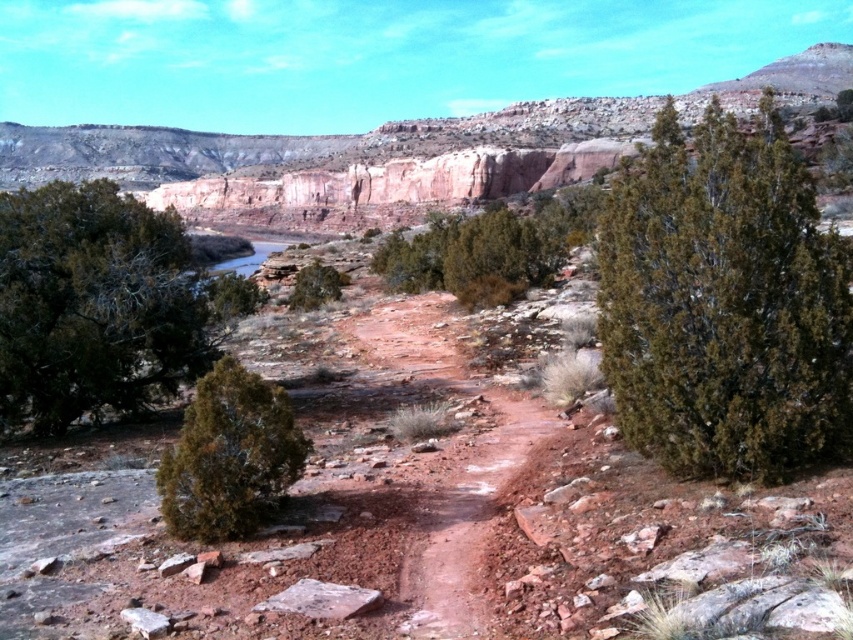
Question: Is green matte tree at lower left closer to the viewer compared to green matte tree at center?

Choices:
 (A) yes
 (B) no

Answer: (A)

Question: Considering the relative positions of green matte tree at left and green matte bush at center in the image provided, where is green matte tree at left located with respect to green matte bush at center?

Choices:
 (A) above
 (B) below

Answer: (B)

Question: Estimate the real-world distances between objects in this image. Which object is farther from the green matte bush at center?

Choices:
 (A) green matte tree at left
 (B) dark green bush at upper right
 (C) green matte tree at center
 (D) green matte tree at lower left

Answer: (A)

Question: Among these points, which one is nearest to the camera?

Choices:
 (A) pos(230,529)
 (B) pos(498,273)
 (C) pos(607,300)
 (D) pos(312,275)

Answer: (A)

Question: Which of the following is the farthest from the observer?

Choices:
 (A) green matte tree at center
 (B) green matte bush at center
 (C) green matte tree at lower left
 (D) green matte tree at left

Answer: (A)

Question: Where is green matte bush at center located in relation to green matte tree at center in the image?

Choices:
 (A) left
 (B) right

Answer: (B)